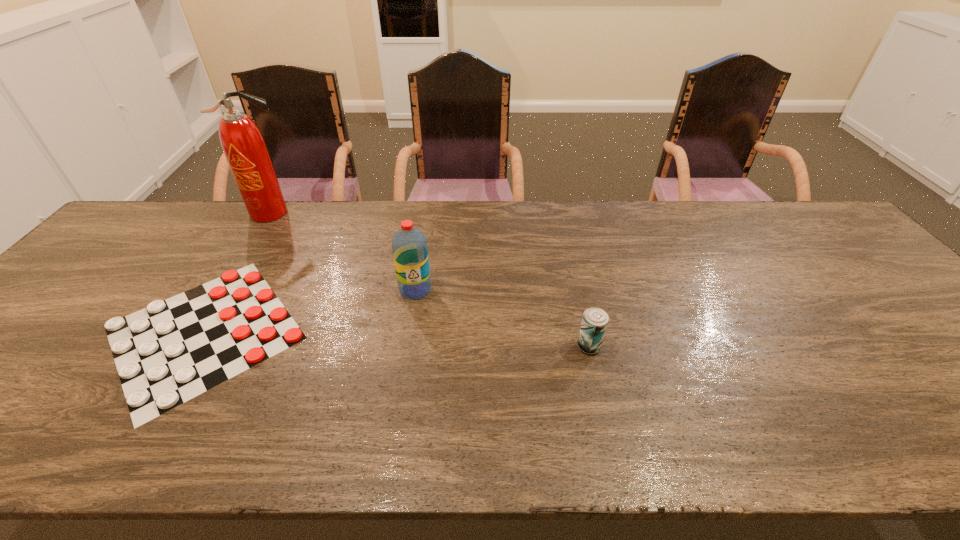
This screenshot has width=960, height=540. In order to click on blank region between the rightmost object and the shortest object in this screenshot , I will do `click(396, 339)`.

Locate an element on the screen. free space between the tallest object and the second tallest object is located at coordinates (344, 251).

What are the coordinates of `vacant area that lies between the third object from left to right and the checkerboard` in the screenshot? It's located at (310, 310).

You are a GUI agent. You are given a task and a screenshot of the screen. Output one action in this format:
    pyautogui.click(x=<x>, y=<y>)
    Task: Click on the free space between the second object from right to left and the fire extinguisher
    The width and height of the screenshot is (960, 540).
    Given the screenshot: What is the action you would take?
    pyautogui.click(x=344, y=251)

Identify which object is the second nearest to the second object from right to left. Please provide its 2D coordinates. Your answer should be formatted as a tuple, i.e. [(x, y)], where the tuple contains the x and y coordinates of a point satisfying the conditions above.

[(595, 320)]

Where is `object that is the third closest to the rightmost object`? Image resolution: width=960 pixels, height=540 pixels. object that is the third closest to the rightmost object is located at coordinates (244, 147).

The image size is (960, 540). I want to click on vacant area that satisfies the following two spatial constraints: 1. on the front label of the third shortest object; 2. on the left side of the beer can, so click(x=406, y=346).